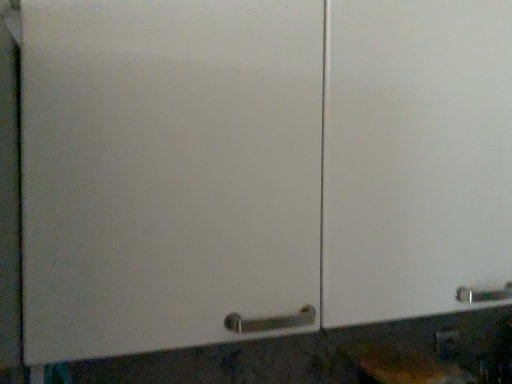
Question: Should I look upward or downward to see matte plastic outlet at lower right?

Choices:
 (A) up
 (B) down

Answer: (B)